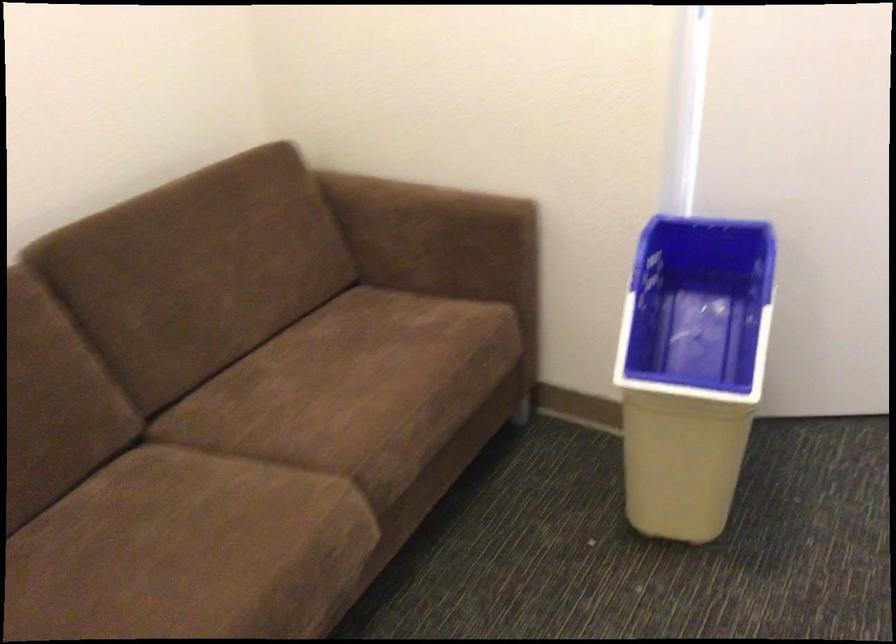
What do you see at coordinates (376, 379) in the screenshot? I see `the brown sofa sitting surface` at bounding box center [376, 379].